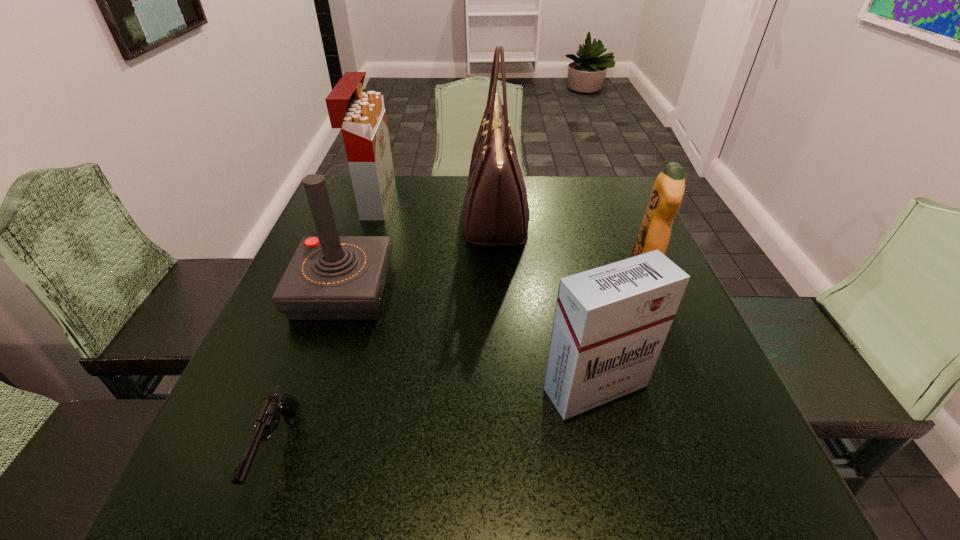
Identify the location of the tallest object. (496, 212).

You are a GUI agent. You are given a task and a screenshot of the screen. Output one action in this format:
    pyautogui.click(x=<x>, y=<y>)
    Task: Click on the taller cigarette case
    
    Given the screenshot: What is the action you would take?
    pyautogui.click(x=361, y=116)

At what (x,y) coordinates should I click in order to perform the action: click on the left cigarette case. Please return your answer as a coordinate pair (x, y). The width and height of the screenshot is (960, 540). Looking at the image, I should click on (361, 116).

Locate an element on the screen. The image size is (960, 540). joystick is located at coordinates (330, 277).

At what (x,y) coordinates should I click in order to perform the action: click on the rightmost object. Please return your answer as a coordinate pair (x, y). Looking at the image, I should click on (668, 190).

Locate an element on the screen. The height and width of the screenshot is (540, 960). the nearer cigarette case is located at coordinates (610, 323).

Locate an element on the screen. the right cigarette case is located at coordinates (610, 323).

Where is `gun`? Image resolution: width=960 pixels, height=540 pixels. gun is located at coordinates 268,418.

Identify the location of blank space located on the front-facing side of the handbag. (351, 217).

Locate an element on the screen. This screenshot has height=540, width=960. free space located on the front-facing side of the handbag is located at coordinates (445, 217).